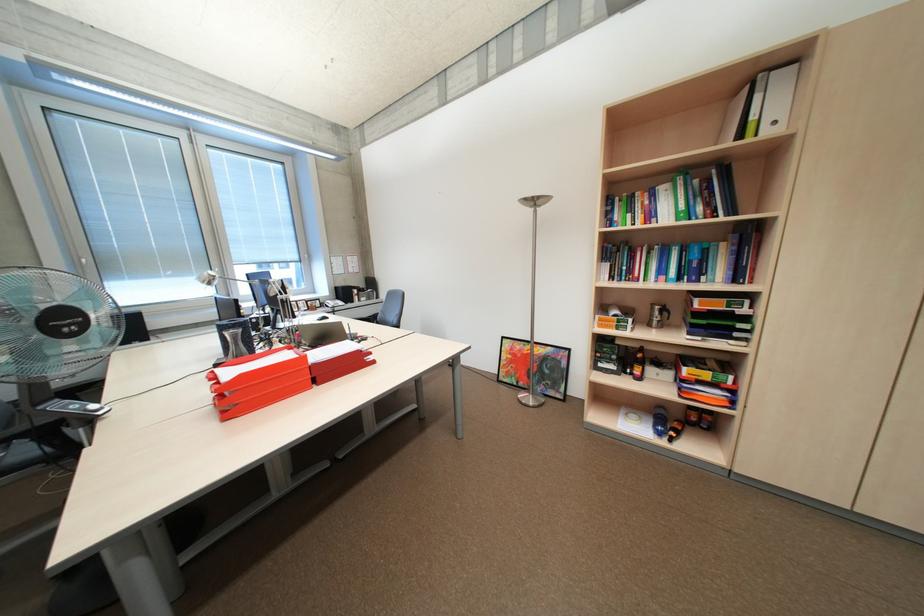
The width and height of the screenshot is (924, 616). Identify the location of white binder. (777, 99).